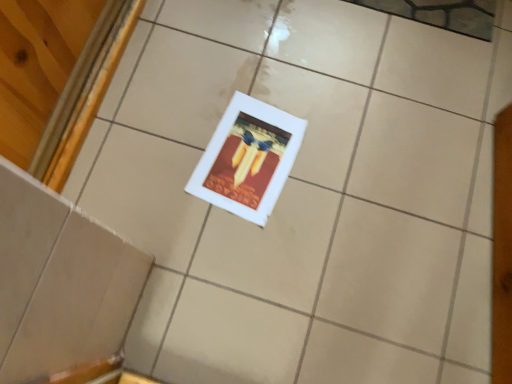
What do you see at coordinates (248, 159) in the screenshot? I see `white matte picture frame at center` at bounding box center [248, 159].

You are a GUI agent. You are given a task and a screenshot of the screen. Output one action in this format:
    pyautogui.click(x=<x>, y=<y>)
    Task: Click on the white matte picture frame at center
    This screenshot has height=384, width=512.
    Given the screenshot: What is the action you would take?
    pyautogui.click(x=248, y=159)

Find the location of `white matte picture frame at center`. white matte picture frame at center is located at coordinates (248, 159).